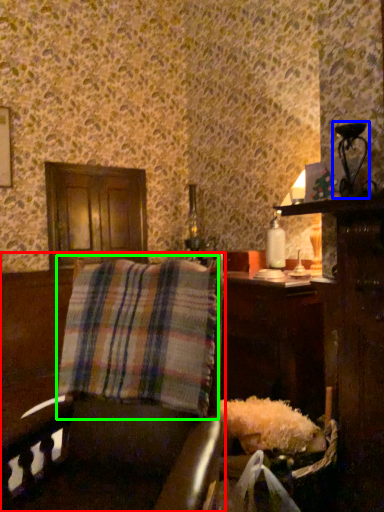
Question: Which is nearer to the furniture (highlighted by a red box)? table lamp (highlighted by a blue box) or plaid (highlighted by a green box).

Choices:
 (A) table lamp
 (B) plaid

Answer: (B)